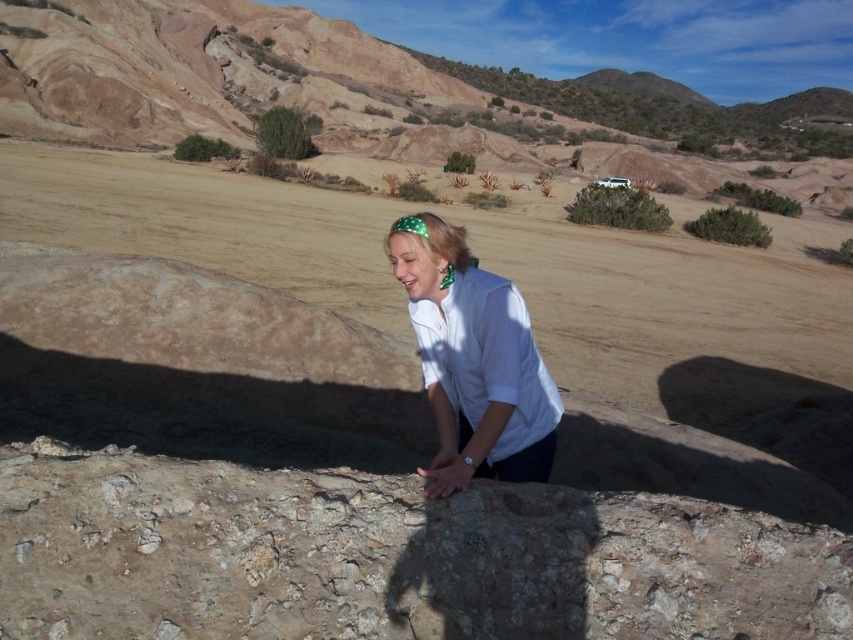
Question: In this image, where is brown sandy dirt field at center located relative to white matte shirt at center?

Choices:
 (A) left
 (B) right

Answer: (A)

Question: Which point is farther from the camera taking this photo?

Choices:
 (A) (804, 314)
 (B) (456, 243)

Answer: (A)

Question: Can you confirm if brown sandy dirt field at center is wider than white matte shirt at center?

Choices:
 (A) no
 (B) yes

Answer: (B)

Question: Which point appears farthest from the camera in this image?

Choices:
 (A) click(547, 456)
 (B) click(206, 198)

Answer: (B)

Question: Is the position of brown sandy dirt field at center less distant than that of white matte shirt at center?

Choices:
 (A) no
 (B) yes

Answer: (A)